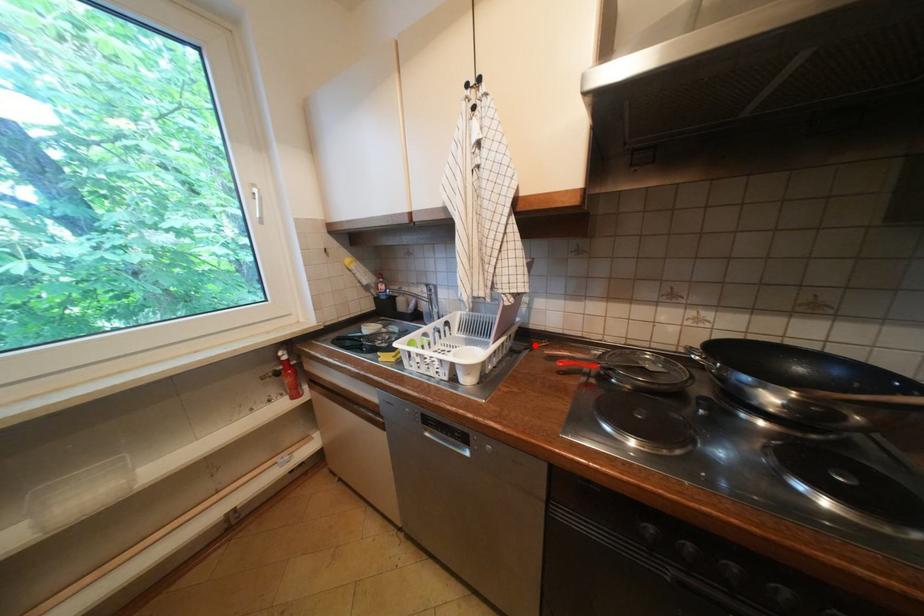
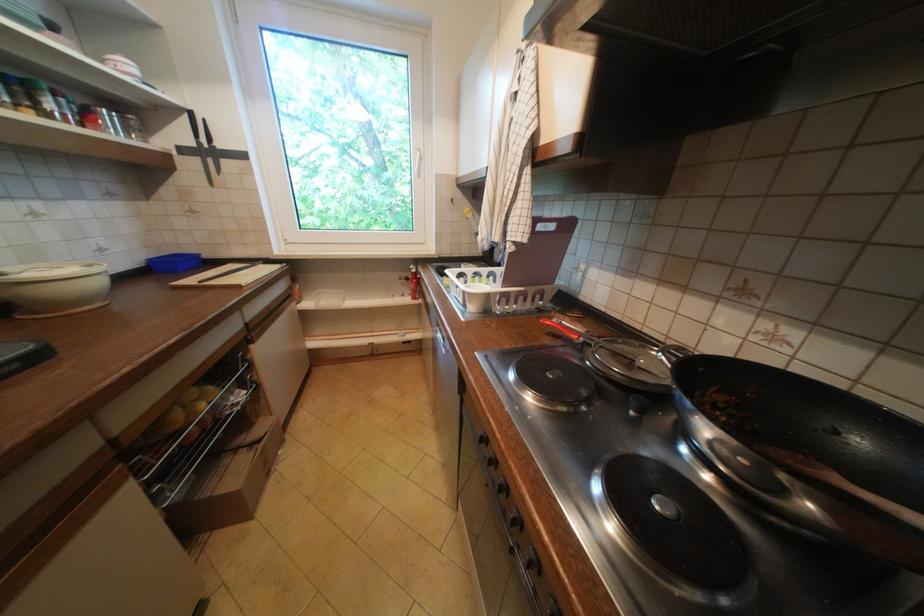
Find the pixel in the second image that matches the highlighted location in the first image.

(565, 310)